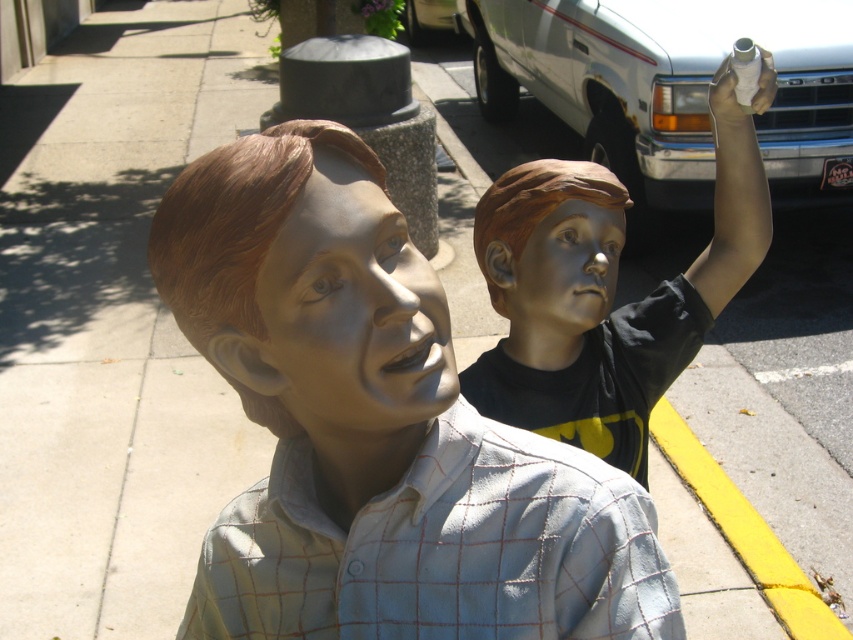
Who is positioned more to the right, blue metallic face at center or white matte hand at upper right?

white matte hand at upper right is more to the right.

Is point (578, 324) behind point (764, 99)?

Yes, it is.

Find the location of a particular element. blue metallic face at center is located at coordinates (561, 269).

Which of these two, matte bronze statue at right or satin gold head at upper right, stands shorter?

satin gold head at upper right

At what (x,y) coordinates should I click in order to perform the action: click on matte bronze statue at right. Please return your answer as a coordinate pair (x, y). The image size is (853, 640). Looking at the image, I should click on (602, 294).

Consider the image. Is the position of smooth silver face at center less distant than that of satin gold head at upper right?

Yes, it is.

Who is more distant from viewer, (357, 346) or (532, 208)?

The point (532, 208) is behind.

Between point (341, 339) and point (515, 256), which one is positioned in front?

Point (341, 339) is more forward.

Locate an element on the screen. This screenshot has height=640, width=853. smooth silver face at center is located at coordinates (346, 317).